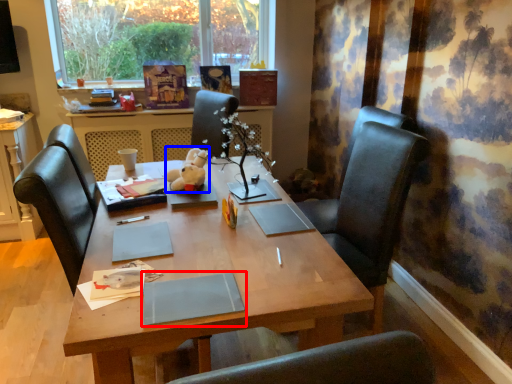
Question: Which object is further to the camera taking this photo, notebook (highlighted by a red box) or toy (highlighted by a blue box)?

Choices:
 (A) notebook
 (B) toy

Answer: (B)